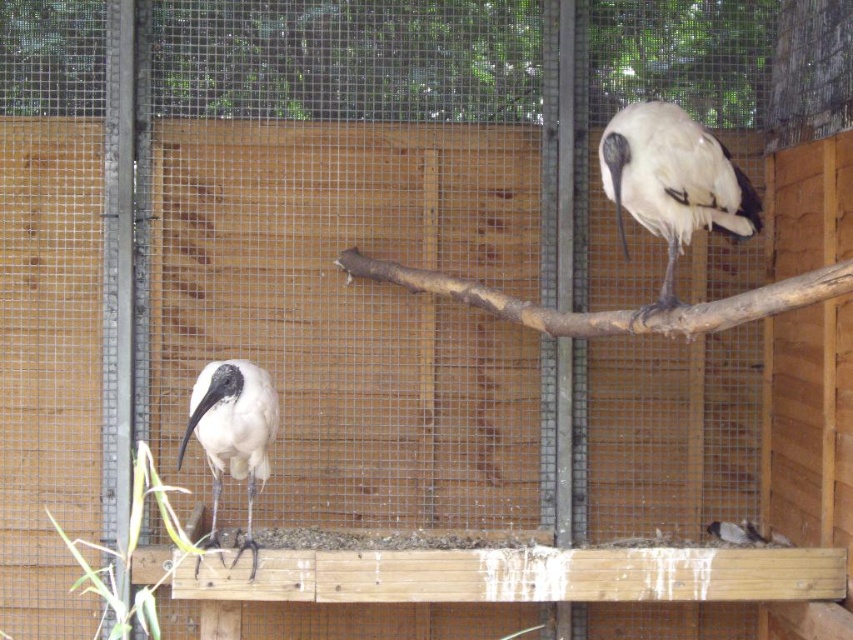
Question: Is white matte ibis at lower left to the right of white feathered bird at lower center from the viewer's perspective?

Choices:
 (A) no
 (B) yes

Answer: (A)

Question: Can you confirm if white matte bird at upper right is positioned to the left of white matte ibis at lower left?

Choices:
 (A) yes
 (B) no

Answer: (B)

Question: Which object is positioned closest to the white feathered bird at lower center?

Choices:
 (A) white matte ibis at lower left
 (B) white matte bird at upper right

Answer: (B)

Question: Can you confirm if white matte bird at upper right is positioned to the left of white matte ibis at lower left?

Choices:
 (A) no
 (B) yes

Answer: (A)

Question: Based on their relative distances, which object is farther from the white matte bird at upper right?

Choices:
 (A) white matte ibis at lower left
 (B) white feathered bird at lower center

Answer: (B)

Question: Which point is farther from the camera taking this photo?

Choices:
 (A) (730, 532)
 (B) (672, 220)

Answer: (A)